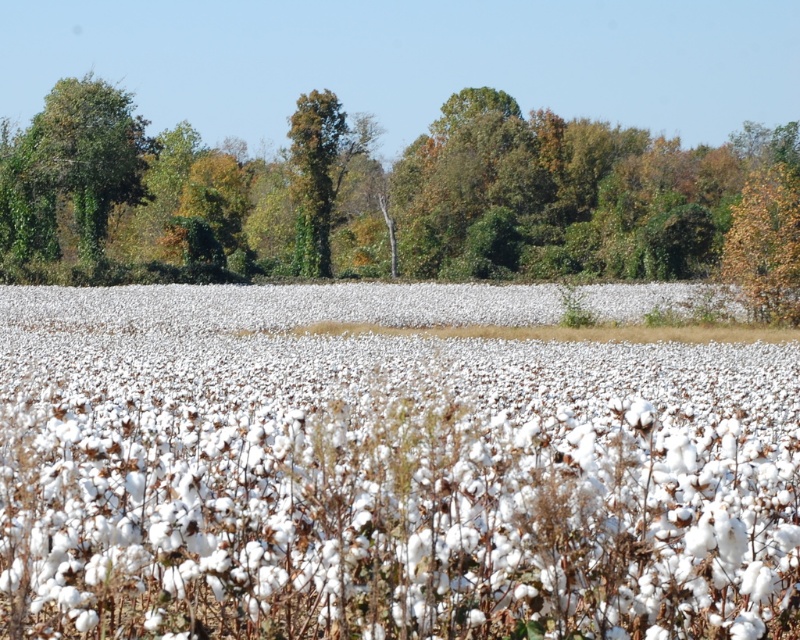
Question: Does green leafy tree at upper left appear over green leafy tree at center?

Choices:
 (A) yes
 (B) no

Answer: (A)

Question: Which object is the farthest from the green leafy tree at upper center?

Choices:
 (A) green leafy tree at center
 (B) green leafy tree at upper left

Answer: (B)

Question: Which point appears closest to the camera in this image?

Choices:
 (A) (336, 141)
 (B) (454, 250)
 (C) (764, 282)

Answer: (C)

Question: Does white fluffy cotton at center have a larger size compared to green leafy tree at center?

Choices:
 (A) no
 (B) yes

Answer: (B)

Question: Among these points, which one is nearest to the camera?

Choices:
 (A) (132, 116)
 (B) (297, 132)
 (C) (664, 218)
 (D) (794, 292)

Answer: (D)

Question: Can you confirm if white fluffy cotton at center is positioned above yellow-green leafy tree at upper right?

Choices:
 (A) yes
 (B) no

Answer: (B)